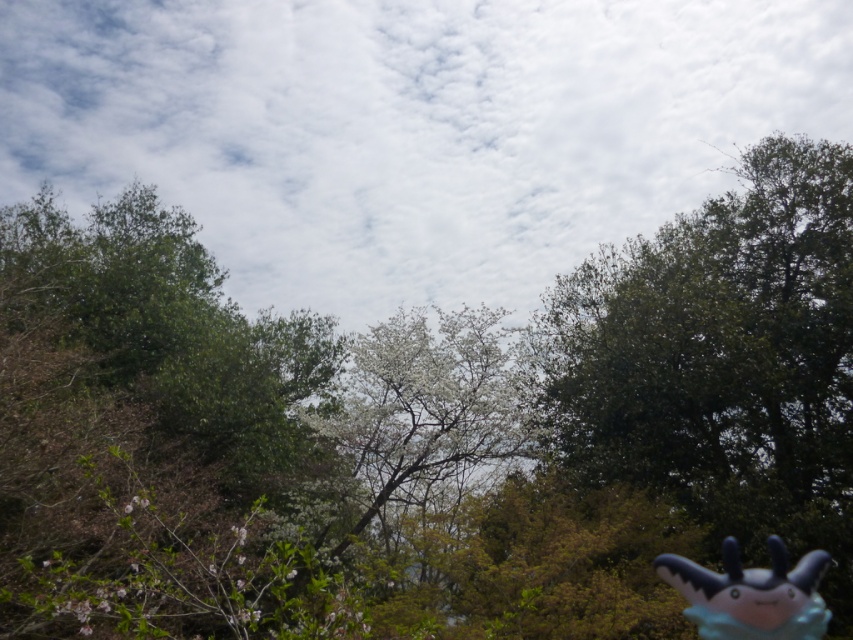
Question: Which object is the farthest from the white blossoming tree at center?

Choices:
 (A) white fluffy cloud at upper center
 (B) green leafy tree at upper left
 (C) blue plush toy at lower right

Answer: (A)

Question: Which of the following is the farthest from the observer?

Choices:
 (A) (666, 560)
 (B) (431, 397)
 (C) (3, 541)
 (D) (331, 61)

Answer: (D)

Question: Does green leafy tree at upper left lie behind white blossoming tree at center?

Choices:
 (A) no
 (B) yes

Answer: (A)

Question: Does white fluffy cloud at upper center have a smaller size compared to blue plush toy at lower right?

Choices:
 (A) no
 (B) yes

Answer: (A)

Question: Which point is farther from the camera taking this photo?

Choices:
 (A) (689, 572)
 (B) (654, 227)
 (C) (161, 305)

Answer: (B)

Question: Is white fluffy cloud at upper center above blue plush toy at lower right?

Choices:
 (A) no
 (B) yes

Answer: (B)